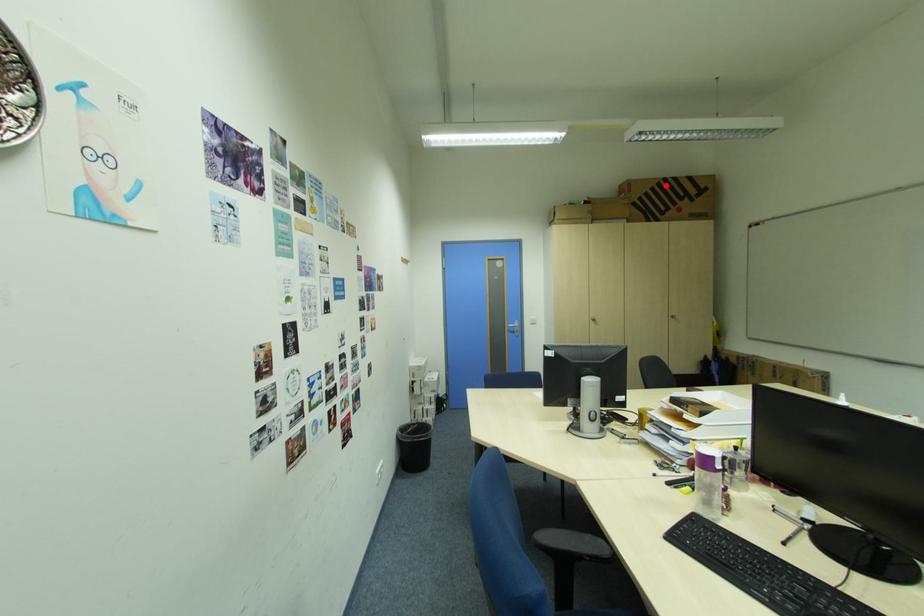
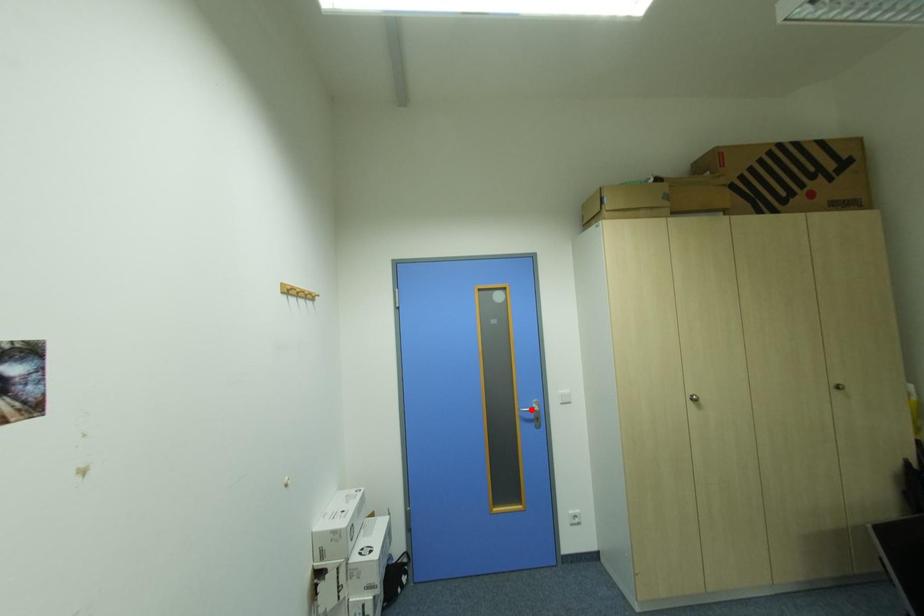
I am providing you with two images of the same scene from different viewpoints. A red point is marked on the first image and another point is marked on the second image. Is the marked point in image1 the same physical position as the marked point in image2?

No